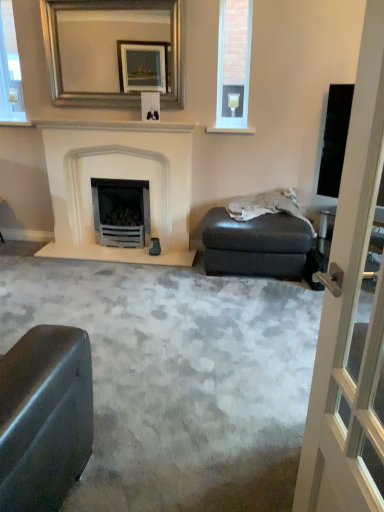
At what (x,y) coordinates should I click in order to perform the action: click on matte black footrest at center right. Please return your answer as a coordinate pair (x, y). The height and width of the screenshot is (512, 384). Looking at the image, I should click on (256, 245).

At what (x,y) coordinates should I click in order to perform the action: click on silver/golden-framed mirror at upper center. Please return your answer as a coordinate pair (x, y). The image size is (384, 512). Looking at the image, I should click on (114, 51).

This screenshot has height=512, width=384. Identify the location of white stone fireplace at center. (122, 178).

Is black glossy screen door at right facing towards white glossy window frame at upper left?

No, black glossy screen door at right is not aimed at white glossy window frame at upper left.

From the image's perspective, between black glossy screen door at right and white glossy window frame at upper left, which one is located above?

white glossy window frame at upper left appears higher in the image.

Is black glossy screen door at right to the right of white glossy window frame at upper left from the viewer's perspective?

Yes.

Is white glossy window frame at upper left a part of black glossy screen door at right?

No, black glossy screen door at right does not contain white glossy window frame at upper left.

Between clear glass window at upper right and matte black footrest at center right, which one has larger width?

With larger width is matte black footrest at center right.

Is there a large distance between clear glass window at upper right and matte black footrest at center right?

clear glass window at upper right is positioned a significant distance from matte black footrest at center right.

Who is smaller, clear glass window at upper right or matte black footrest at center right?

With smaller size is clear glass window at upper right.

From a real-world perspective, is clear glass window at upper right positioned above or below matte black footrest at center right?

clear glass window at upper right is above matte black footrest at center right.

From a real-world perspective, between black glossy screen door at right and white stone fireplace at center, who is vertically lower?

white stone fireplace at center is physically lower.

Is black glossy screen door at right closer to camera compared to white stone fireplace at center?

Yes, it is in front of white stone fireplace at center.

The height and width of the screenshot is (512, 384). What are the coordinates of `screen door above the white stone fireplace at center (from a real-world perspective)` in the screenshot? It's located at (350, 312).

Based on their positions, is black glossy screen door at right located to the left or right of white stone fireplace at center?

Based on their positions, black glossy screen door at right is located to the right of white stone fireplace at center.

Between clear glass window at upper right and white glossy window frame at upper left, which one has more height?

white glossy window frame at upper left is taller.

Considering the relative sizes of clear glass window at upper right and white glossy window frame at upper left in the image provided, is clear glass window at upper right smaller than white glossy window frame at upper left?

No.

Is clear glass window at upper right aimed at white glossy window frame at upper left?

No, clear glass window at upper right is not aimed at white glossy window frame at upper left.

Is clear glass window at upper right further to the viewer compared to white glossy window frame at upper left?

No.

Is white glossy window frame at upper left not inside clear glass window at upper right?

Yes, white glossy window frame at upper left is not within clear glass window at upper right.

From a real-world perspective, which object stands above the other?

A: white glossy window frame at upper left is physically above.

Is white glossy window frame at upper left positioned far away from clear glass window at upper right?

That's right, there is a large distance between white glossy window frame at upper left and clear glass window at upper right.

From the image's perspective, which is below, white glossy window frame at upper left or clear glass window at upper right?

clear glass window at upper right, from the image's perspective.

Could you tell me if white stone fireplace at center is turned towards matte black footrest at center right?

No, white stone fireplace at center is not oriented towards matte black footrest at center right.

Is white stone fireplace at center not inside matte black footrest at center right?

white stone fireplace at center lies outside matte black footrest at center right's area.

Is white stone fireplace at center thinner than matte black footrest at center right?

Yes.

Is the depth of white stone fireplace at center greater than that of clear glass window at upper right?

No, it is not.

Is white stone fireplace at center surrounding clear glass window at upper right?

No, white stone fireplace at center does not contain clear glass window at upper right.

Can you confirm if white stone fireplace at center is positioned to the left of clear glass window at upper right?

Yes.

I want to click on screen door below the white glossy window frame at upper left (from the image's perspective), so click(x=350, y=312).

I want to click on window above the matte black footrest at center right (from the image's perspective), so click(233, 65).

Estimate the real-world distances between objects in this image. Which object is closer to white stone fireplace at center, black glossy screen door at right or matte black footrest at center right?

matte black footrest at center right is positioned closer to the anchor white stone fireplace at center.

Based on their spatial positions, is matte black footrest at center right or silver/golden-framed mirror at upper center further from white glossy window frame at upper left?

Among the two, matte black footrest at center right is located further to white glossy window frame at upper left.

From the image, which object appears to be farther from white glossy window frame at upper left, black glossy screen door at right or matte black footrest at center right?

black glossy screen door at right.

From the image, which object appears to be farther from black glossy screen door at right, white glossy window frame at upper left or white stone fireplace at center?

white glossy window frame at upper left is further to black glossy screen door at right.

Based on their spatial positions, is matte black footrest at center right or silver/golden-framed mirror at upper center closer to white stone fireplace at center?

The object closer to white stone fireplace at center is silver/golden-framed mirror at upper center.

Estimate the real-world distances between objects in this image. Which object is further from black glossy screen door at right, matte black footrest at center right or silver/golden-framed mirror at upper center?

Among the two, silver/golden-framed mirror at upper center is located further to black glossy screen door at right.

Which object lies further to the anchor point white glossy window frame at upper left, silver/golden-framed mirror at upper center or black glossy screen door at right?

black glossy screen door at right lies further to white glossy window frame at upper left than the other object.

When comparing their distances from matte black footrest at center right, does white stone fireplace at center or clear glass window at upper right seem further?

clear glass window at upper right is further to matte black footrest at center right.

The width and height of the screenshot is (384, 512). Find the location of `mirror between white glossy window frame at upper left and white stone fireplace at center from top to bottom`. mirror between white glossy window frame at upper left and white stone fireplace at center from top to bottom is located at coordinates (114, 51).

Image resolution: width=384 pixels, height=512 pixels. Identify the location of fireplace between white glossy window frame at upper left and clear glass window at upper right from left to right. (122, 178).

You are a GUI agent. You are given a task and a screenshot of the screen. Output one action in this format:
    pyautogui.click(x=<x>, y=<y>)
    Task: Click on the fireplace located between black glossy screen door at right and white glossy window frame at upper left in the depth direction
    Image resolution: width=384 pixels, height=512 pixels.
    Given the screenshot: What is the action you would take?
    pyautogui.click(x=122, y=178)

Where is `window between silver/golden-framed mirror at upper center and matte black footrest at center right from top to bottom`? This screenshot has height=512, width=384. window between silver/golden-framed mirror at upper center and matte black footrest at center right from top to bottom is located at coordinates (233, 65).